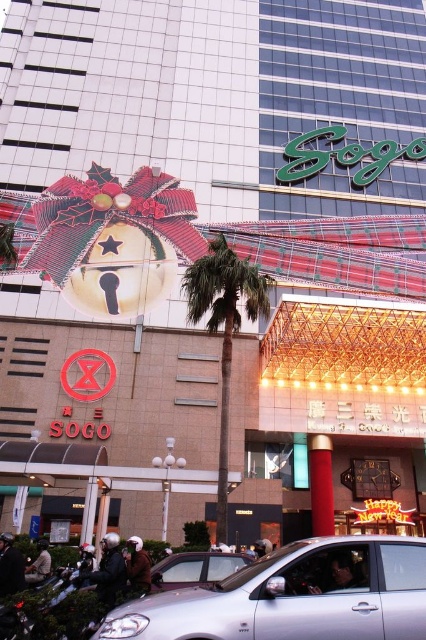
Does silver metallic car at lower center have a greater width compared to silver metallic car at center?

Correct, the width of silver metallic car at lower center exceeds that of silver metallic car at center.

Between silver metallic car at lower center and silver metallic car at center, which one has less height?

Standing shorter between the two is silver metallic car at center.

Is point (201, 589) positioned behind point (180, 577)?

No, (201, 589) is closer to viewer.

Identify the location of silver metallic car at lower center. The image size is (426, 640). (294, 596).

Measure the distance between green leafy palm tree at center and camera.

green leafy palm tree at center and camera are 35.88 meters apart.

The width and height of the screenshot is (426, 640). What do you see at coordinates (224, 326) in the screenshot? I see `green leafy palm tree at center` at bounding box center [224, 326].

Locate an element on the screen. This screenshot has height=640, width=426. green leafy palm tree at center is located at coordinates (224, 326).

Find the location of `silver metallic car at lower center`. silver metallic car at lower center is located at coordinates (294, 596).

Who is taller, silver metallic car at lower center or green leafy palm tree at center?

Standing taller between the two is green leafy palm tree at center.

The height and width of the screenshot is (640, 426). What are the coordinates of `silver metallic car at lower center` in the screenshot? It's located at (294, 596).